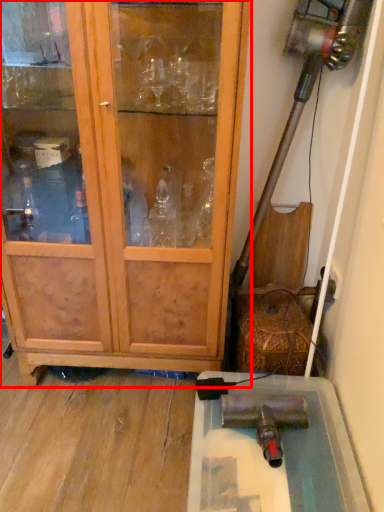
Question: From the image's perspective, what is the correct spatial relationship of cupboard (annotated by the red box) in relation to cabinetry?

Choices:
 (A) below
 (B) above

Answer: (B)